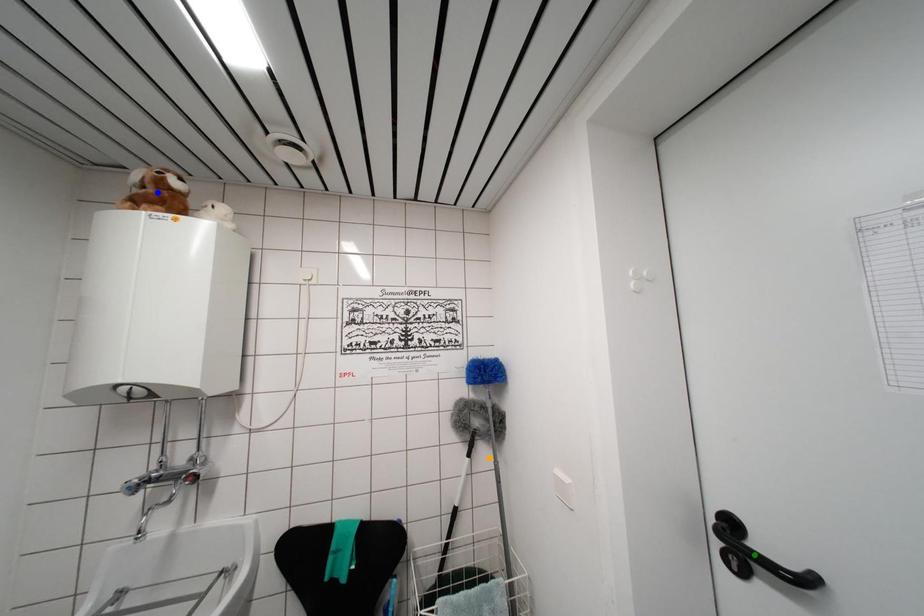
Order these from farthest to nearest:
1. green point
2. blue point
3. orange point

orange point → blue point → green point